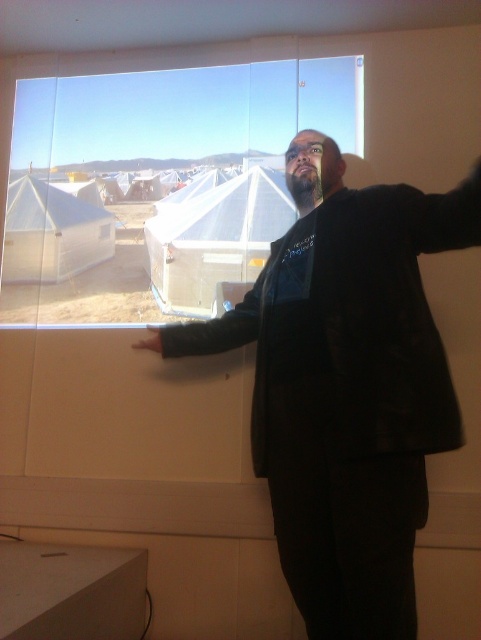
Question: Among these objects, which one is farthest from the camera?

Choices:
 (A) transparent glass window at upper center
 (B) black leather jacket at upper right

Answer: (A)

Question: Which object is closer to the camera taking this photo?

Choices:
 (A) black matte hand at lower left
 (B) transparent glass window at upper center

Answer: (A)

Question: Does black leather jacket at upper right come behind black matte hand at lower left?

Choices:
 (A) no
 (B) yes

Answer: (A)

Question: Which object is closer to the camera taking this photo?

Choices:
 (A) black matte hand at lower left
 (B) transparent glass window at upper center

Answer: (A)

Question: Can you confirm if transparent glass window at upper center is positioned to the right of black matte hand at lower left?

Choices:
 (A) yes
 (B) no

Answer: (A)

Question: Can you confirm if black leather jacket at upper right is positioned to the left of transparent glass window at upper center?

Choices:
 (A) yes
 (B) no

Answer: (B)